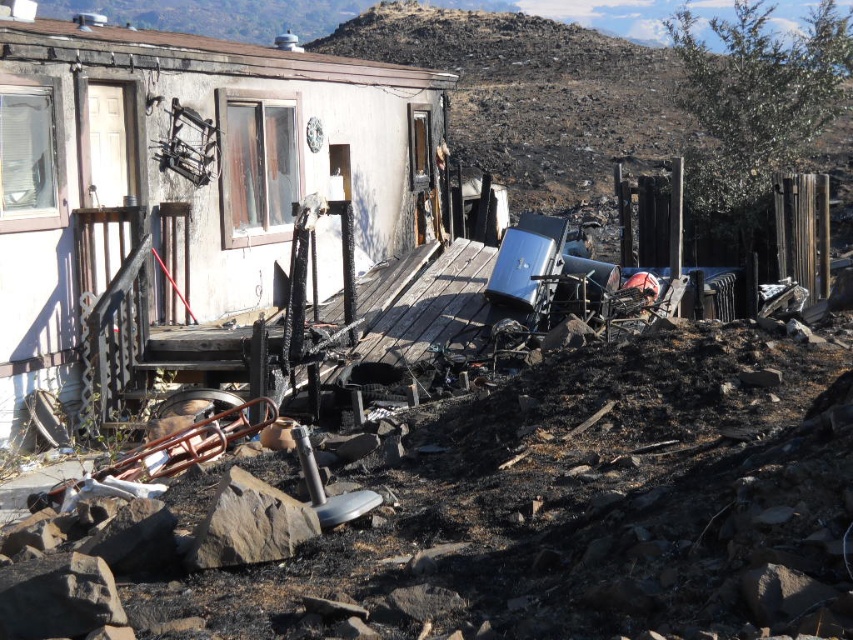
You are a firefighter assessing the damage after a fire. You notice burnt soil at upper center and a brown rough rock at lower center. Which object is closer to you from your vantage point?

The burnt soil at upper center is closer to you because the brown rough rock at lower center is positioned behind it.

You are a firefighter assessing the damage after a fire. You notice two objects at the scene, the burnt soil at upper center and the brown rough rock at lower center. Which object has a greater width?

The burnt soil at upper center has a greater width than the brown rough rock at lower center.

You are an environmental inspector assessing the fire damage. You notice burnt soil at upper center and brown rough rock at lower center. Which object is located higher in the image?

The burnt soil at upper center is positioned over brown rough rock at lower center, so it is higher in the image.